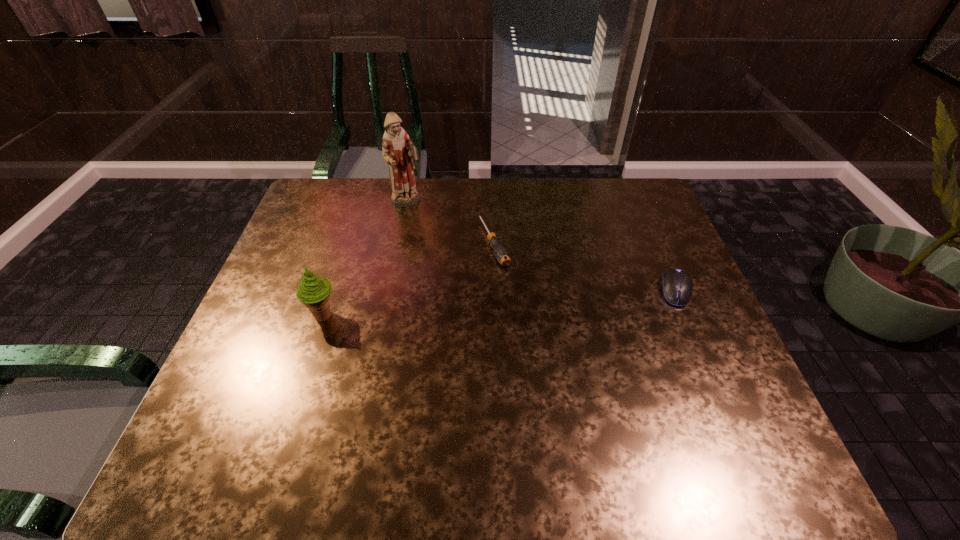
The image size is (960, 540). In order to click on vacant space located 0.320m on the front-facing side of the farthest object in this screenshot , I will do `click(468, 268)`.

What are the coordinates of `vacant area situated 0.100m on the front-facing side of the farthest object` in the screenshot? It's located at (430, 226).

Where is `vacant space located at the tip of the third nearest object`? The height and width of the screenshot is (540, 960). vacant space located at the tip of the third nearest object is located at coordinates (509, 285).

At what (x,y) coordinates should I click in order to perform the action: click on free space located at the tip of the third nearest object. Please return your answer as a coordinate pair (x, y). Looking at the image, I should click on (551, 364).

Where is `free space located 0.120m at the tip of the third nearest object`? free space located 0.120m at the tip of the third nearest object is located at coordinates (516, 299).

You are a GUI agent. You are given a task and a screenshot of the screen. Output one action in this format:
    pyautogui.click(x=<x>, y=<y>)
    Task: Click on the figurine that is positioned at the far edge
    The width and height of the screenshot is (960, 540).
    Given the screenshot: What is the action you would take?
    pyautogui.click(x=398, y=151)

This screenshot has height=540, width=960. I want to click on screwdriver present at the far edge, so (500, 252).

Where is `object located at the left edge`? This screenshot has width=960, height=540. object located at the left edge is located at coordinates (313, 291).

In order to click on object at the right edge in this screenshot , I will do `click(677, 286)`.

Locate an element on the screen. The height and width of the screenshot is (540, 960). vacant region at the far edge is located at coordinates (429, 215).